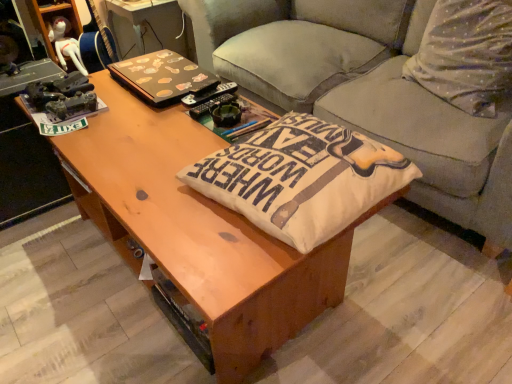
Where is `brown matte laptop at upper center`? The width and height of the screenshot is (512, 384). brown matte laptop at upper center is located at coordinates (162, 77).

You are a GUI agent. You are given a task and a screenshot of the screen. Output one action in this format:
    pyautogui.click(x=<x>, y=<y>)
    Task: Click on the beige fabric cushion at center, marked as the first throw pillow in a bottom-to-top arrangement
    The height and width of the screenshot is (384, 512).
    Given the screenshot: What is the action you would take?
    pyautogui.click(x=301, y=178)

Identify the location of brown matte laptop at upper center. This screenshot has width=512, height=384. (162, 77).

You are a GUI agent. You are given a task and a screenshot of the screen. Output one action in this format:
    pyautogui.click(x=<x>, y=<y>)
    Task: Click on the throw pillow that appears on the left of white cotton pillow at upper right, the 2th throw pillow in the front-to-back sequence
    
    Given the screenshot: What is the action you would take?
    (301, 178)

Is beige fabric cushion at center, marked as the 2th throw pillow in a top-to-bottom arrangement, not near white cotton pillow at upper right, which is the second throw pillow from bottom to top?

beige fabric cushion at center, marked as the 2th throw pillow in a top-to-bottom arrangement, is near white cotton pillow at upper right, which is the second throw pillow from bottom to top, not far away.

Measure the distance from beige fabric cushion at center, the second throw pillow viewed from the back, to white cotton pillow at upper right, acting as the first throw pillow starting from the back.

beige fabric cushion at center, the second throw pillow viewed from the back, is 33.16 inches from white cotton pillow at upper right, acting as the first throw pillow starting from the back.

Considering the positions of objects beige fabric cushion at center, marked as the 2th throw pillow in a top-to-bottom arrangement, and white cotton pillow at upper right, the first throw pillow viewed from the right, in the image provided, who is behind, beige fabric cushion at center, marked as the 2th throw pillow in a top-to-bottom arrangement, or white cotton pillow at upper right, the first throw pillow viewed from the right,?

white cotton pillow at upper right, the first throw pillow viewed from the right.

Is beige fabric cushion at center, which is the second throw pillow from right to left, inside brown matte laptop at upper center?

That's incorrect, beige fabric cushion at center, which is the second throw pillow from right to left, is not inside brown matte laptop at upper center.

Does brown matte laptop at upper center come in front of beige fabric cushion at center, marked as the 2th throw pillow in a top-to-bottom arrangement?

No.

Which of these two, brown matte laptop at upper center or beige fabric cushion at center, the first throw pillow in the left-to-right sequence, stands shorter?

With less height is beige fabric cushion at center, the first throw pillow in the left-to-right sequence.

Is point (199, 81) closer or farther from the camera than point (382, 173)?

Point (199, 81) appears to be farther away from the viewer than point (382, 173).

Who is taller, gray fabric couch at center or white cotton pillow at upper right, marked as the second throw pillow in a left-to-right arrangement?

gray fabric couch at center is taller.

From a real-world perspective, is gray fabric couch at center beneath white cotton pillow at upper right, the 2th throw pillow in the front-to-back sequence?

Yes.

Does gray fabric couch at center turn towards white cotton pillow at upper right, the first throw pillow viewed from the right?

Yes, gray fabric couch at center is aimed at white cotton pillow at upper right, the first throw pillow viewed from the right.

From the image's perspective, is gray fabric couch at center located above brown matte laptop at upper center?

Correct, gray fabric couch at center appears higher than brown matte laptop at upper center in the image.

Considering the relative sizes of gray fabric couch at center and brown matte laptop at upper center in the image provided, is gray fabric couch at center smaller than brown matte laptop at upper center?

No.

Who is taller, gray fabric couch at center or brown matte laptop at upper center?

With more height is gray fabric couch at center.

Find the location of a particular element. The height and width of the screenshot is (384, 512). laptop behind the gray fabric couch at center is located at coordinates (162, 77).

From the image's perspective, between white cotton pillow at upper right, which is the second throw pillow from bottom to top, and beige fabric cushion at center, marked as the first throw pillow in a bottom-to-top arrangement, who is located below?

beige fabric cushion at center, marked as the first throw pillow in a bottom-to-top arrangement.

Is white cotton pillow at upper right, which is the second throw pillow from bottom to top, at the left side of beige fabric cushion at center, which is the 1th throw pillow from front to back?

Incorrect, white cotton pillow at upper right, which is the second throw pillow from bottom to top, is not on the left side of beige fabric cushion at center, which is the 1th throw pillow from front to back.

Can you confirm if white cotton pillow at upper right, which appears as the 1th throw pillow when viewed from the top, is taller than beige fabric cushion at center, which is the 1th throw pillow from front to back?

Yes.

Which of these two, white cotton pillow at upper right, acting as the first throw pillow starting from the back, or brown matte laptop at upper center, is wider?

Wider between the two is brown matte laptop at upper center.

Which object is further away from the camera, white cotton pillow at upper right, the 2th throw pillow in the front-to-back sequence, or brown matte laptop at upper center?

brown matte laptop at upper center is further away from the camera.

Which is behind, point (452, 103) or point (146, 60)?

The point (146, 60) is behind.

Locate an element on the screen. The height and width of the screenshot is (384, 512). laptop above the white cotton pillow at upper right, which is the second throw pillow from bottom to top (from a real-world perspective) is located at coordinates (162, 77).

Could you measure the distance between brown matte laptop at upper center and white cotton pillow at upper right, the first throw pillow viewed from the right?

brown matte laptop at upper center and white cotton pillow at upper right, the first throw pillow viewed from the right, are 36.94 inches apart from each other.

Which object is more forward, brown matte laptop at upper center or white cotton pillow at upper right, which is the second throw pillow from bottom to top?

white cotton pillow at upper right, which is the second throw pillow from bottom to top, is more forward.

Is white cotton pillow at upper right, which is the second throw pillow from bottom to top, completely or partially inside brown matte laptop at upper center?

No, white cotton pillow at upper right, which is the second throw pillow from bottom to top, is not inside brown matte laptop at upper center.

Where is `throw pillow positioned vertically above the white cotton pillow at upper right, the first throw pillow viewed from the right (from a real-world perspective)`? The width and height of the screenshot is (512, 384). throw pillow positioned vertically above the white cotton pillow at upper right, the first throw pillow viewed from the right (from a real-world perspective) is located at coordinates (301, 178).

From the brown matte laptop at upper center, count 1st throw pillow to the right and point to it. Please provide its 2D coordinates.

[(301, 178)]

Considering their positions, is white cotton pillow at upper right, the first throw pillow viewed from the right, positioned further to beige fabric cushion at center, the first throw pillow in the left-to-right sequence, than brown matte laptop at upper center?

white cotton pillow at upper right, the first throw pillow viewed from the right.

Based on their spatial positions, is beige fabric cushion at center, the first throw pillow in the left-to-right sequence, or white cotton pillow at upper right, which is the second throw pillow from bottom to top, closer to gray fabric couch at center?

Among the two, white cotton pillow at upper right, which is the second throw pillow from bottom to top, is located nearer to gray fabric couch at center.

Looking at the image, which one is located closer to gray fabric couch at center, brown matte laptop at upper center or white cotton pillow at upper right, the 2th throw pillow in the front-to-back sequence?

white cotton pillow at upper right, the 2th throw pillow in the front-to-back sequence.

Considering their positions, is gray fabric couch at center positioned closer to beige fabric cushion at center, marked as the first throw pillow in a bottom-to-top arrangement, than brown matte laptop at upper center?

brown matte laptop at upper center lies closer to beige fabric cushion at center, marked as the first throw pillow in a bottom-to-top arrangement, than the other object.

Which object lies nearer to the anchor point beige fabric cushion at center, the second throw pillow viewed from the back, brown matte laptop at upper center or white cotton pillow at upper right, the first throw pillow viewed from the right?

brown matte laptop at upper center.

Looking at the image, which one is located closer to brown matte laptop at upper center, gray fabric couch at center or beige fabric cushion at center, marked as the 2th throw pillow in a top-to-bottom arrangement?

beige fabric cushion at center, marked as the 2th throw pillow in a top-to-bottom arrangement, lies closer to brown matte laptop at upper center than the other object.

When comparing their distances from beige fabric cushion at center, which is the 1th throw pillow from front to back, does brown matte laptop at upper center or gray fabric couch at center seem further?

gray fabric couch at center lies further to beige fabric cushion at center, which is the 1th throw pillow from front to back, than the other object.

From the image, which object appears to be nearer to brown matte laptop at upper center, white cotton pillow at upper right, which is the second throw pillow from bottom to top, or gray fabric couch at center?

Among the two, gray fabric couch at center is located nearer to brown matte laptop at upper center.

Find the location of a particular element. This screenshot has height=384, width=512. throw pillow that lies between gray fabric couch at center and beige fabric cushion at center, the second throw pillow viewed from the back, from top to bottom is located at coordinates (466, 55).

Locate an element on the screen. This screenshot has width=512, height=384. throw pillow between brown matte laptop at upper center and white cotton pillow at upper right, the first throw pillow viewed from the right, in the horizontal direction is located at coordinates (301, 178).

Where is `studio couch between brown matte laptop at upper center and white cotton pillow at upper right, marked as the second throw pillow in a left-to-right arrangement, in the horizontal direction`? Image resolution: width=512 pixels, height=384 pixels. studio couch between brown matte laptop at upper center and white cotton pillow at upper right, marked as the second throw pillow in a left-to-right arrangement, in the horizontal direction is located at coordinates (366, 92).

Locate an element on the screen. This screenshot has width=512, height=384. throw pillow between brown matte laptop at upper center and gray fabric couch at center is located at coordinates (301, 178).